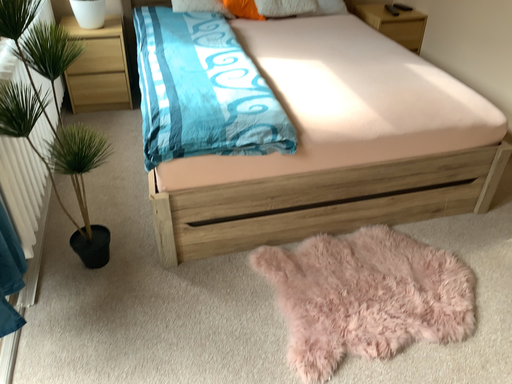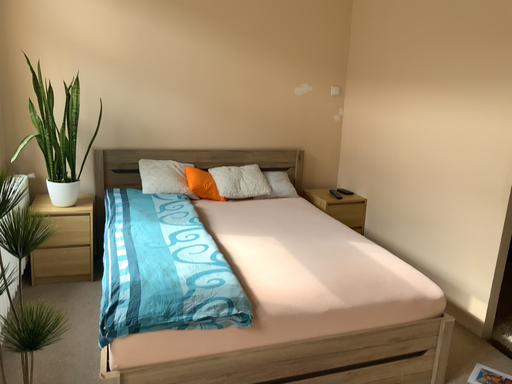
Question: Which way did the camera rotate in the video?

Choices:
 (A) rotated upward
 (B) rotated downward

Answer: (A)